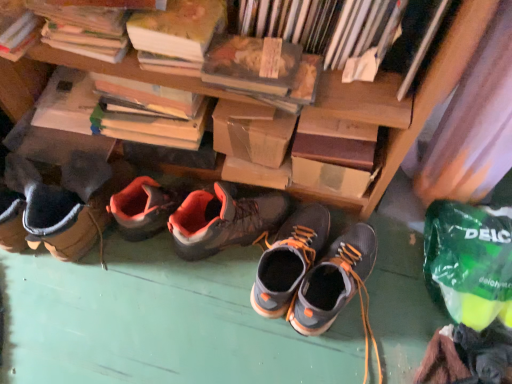
At what (x,y) coordinates should I click in order to perform the action: click on unoccupied area in front of dark gray suede shoes at center, placed as the second footwear when sorted from left to right. Please return your answer as a coordinate pair (x, y). The image size is (512, 384). Looking at the image, I should click on (297, 349).